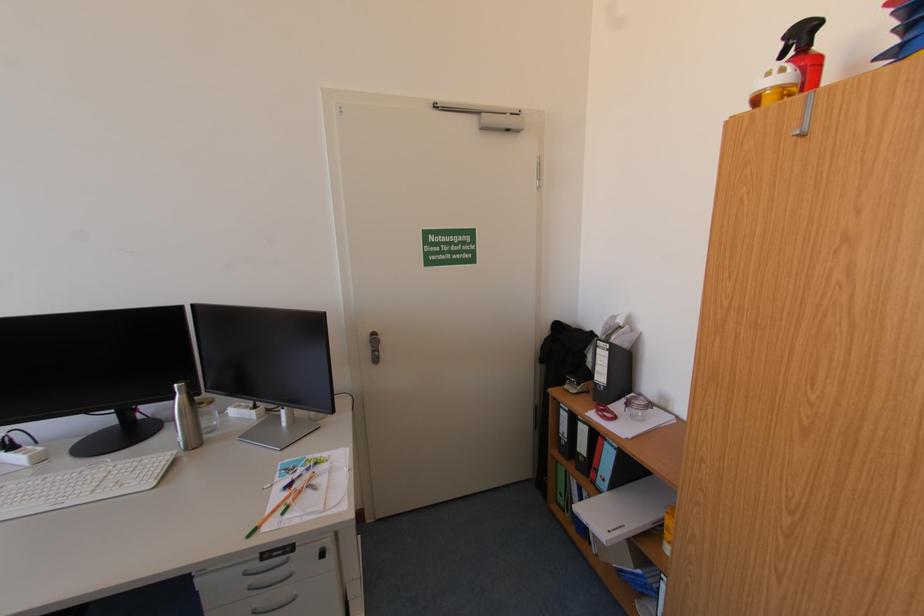
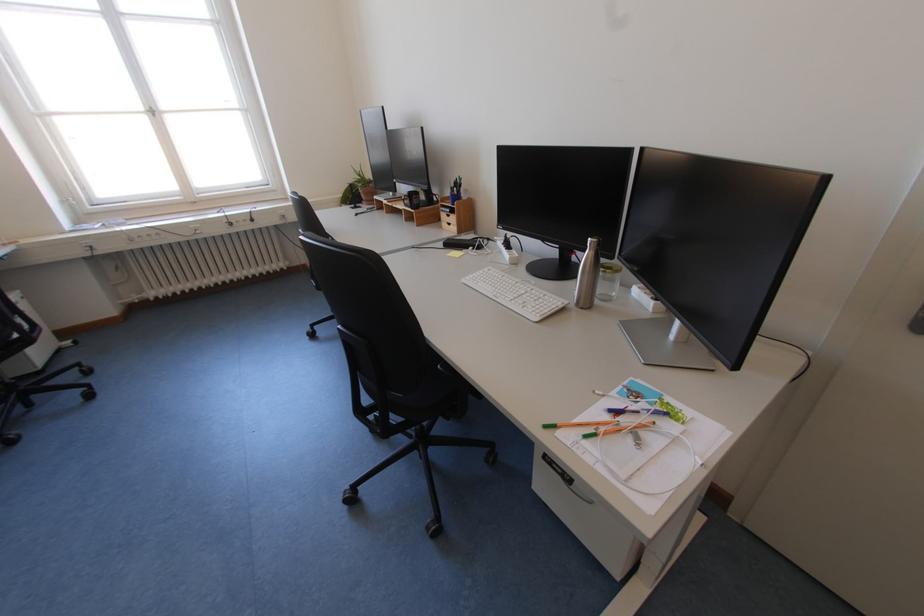
Where in the second image is the point corresponding to (x=210, y=403) from the first image?

(617, 270)